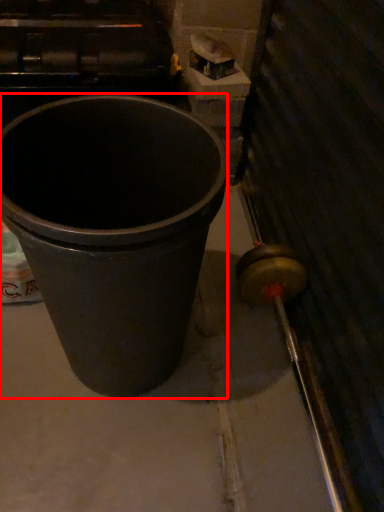
Question: From the image's perspective, what is the correct spatial positioning of waste container (annotated by the red box) in reference to concrete?

Choices:
 (A) above
 (B) below

Answer: (A)